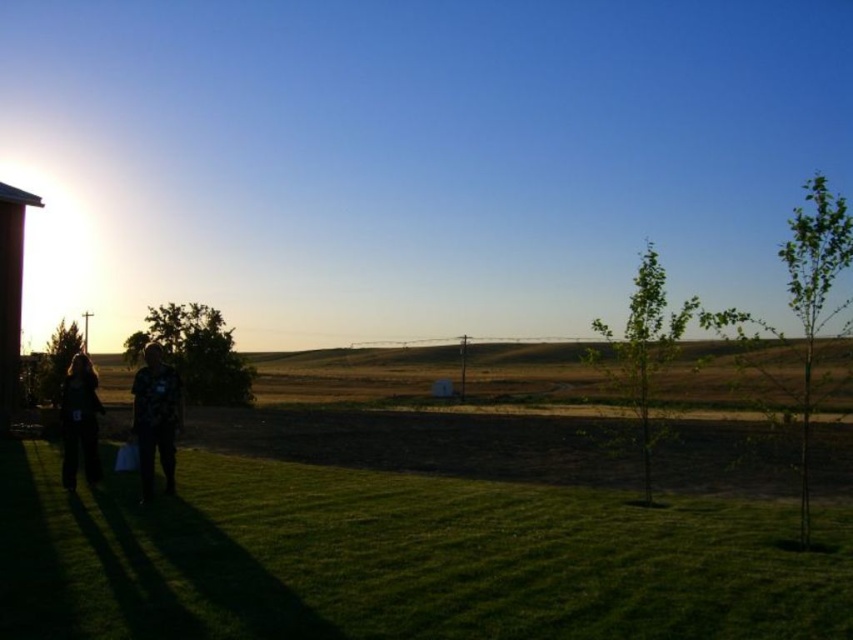
Which is more to the left, green grassy at lower left or rustic wooden hut at left?

Positioned to the left is rustic wooden hut at left.

Can you confirm if green grassy at lower left is thinner than rustic wooden hut at left?

No, green grassy at lower left is not thinner than rustic wooden hut at left.

Who is more distant from viewer, (442, 554) or (6, 234)?

The point (6, 234) is more distant.

I want to click on green grassy at lower left, so click(x=399, y=560).

Is dark clothing couple at lower left wider than dark clothing figure at lower left?

In fact, dark clothing couple at lower left might be narrower than dark clothing figure at lower left.

Consider the image. Between dark clothing couple at lower left and dark clothing figure at lower left, which one has less height?

With less height is dark clothing figure at lower left.

Locate an element on the screen. dark clothing couple at lower left is located at coordinates (155, 417).

You are a GUI agent. You are given a task and a screenshot of the screen. Output one action in this format:
    pyautogui.click(x=<x>, y=<y>)
    Task: Click on the dark clothing couple at lower left
    This screenshot has width=853, height=640.
    Given the screenshot: What is the action you would take?
    pyautogui.click(x=155, y=417)

Does dark clothing couple at lower left have a larger size compared to rustic wooden hut at left?

Incorrect, dark clothing couple at lower left is not larger than rustic wooden hut at left.

Can you confirm if dark clothing couple at lower left is wider than rustic wooden hut at left?

In fact, dark clothing couple at lower left might be narrower than rustic wooden hut at left.

Is point (148, 432) in front of point (15, 232)?

Yes, it is in front of point (15, 232).

The image size is (853, 640). Find the location of `dark clothing couple at lower left`. dark clothing couple at lower left is located at coordinates 155,417.